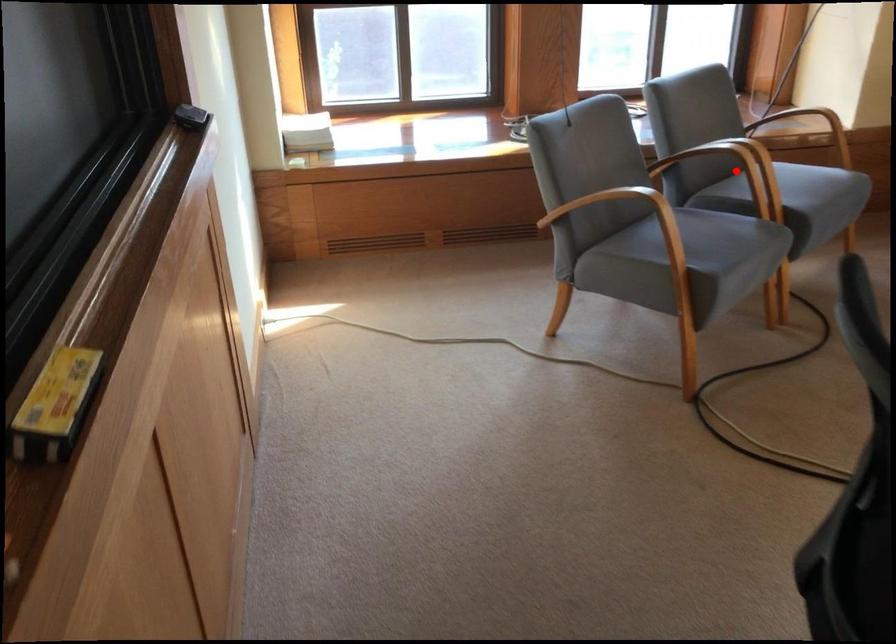
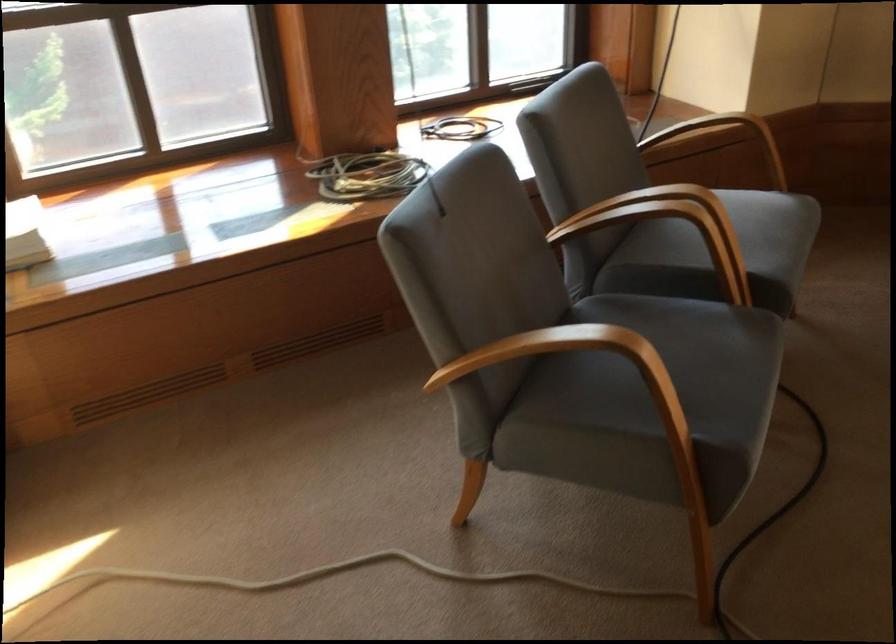
Find the pixel in the second image that matches the highlighted location in the first image.

(664, 234)